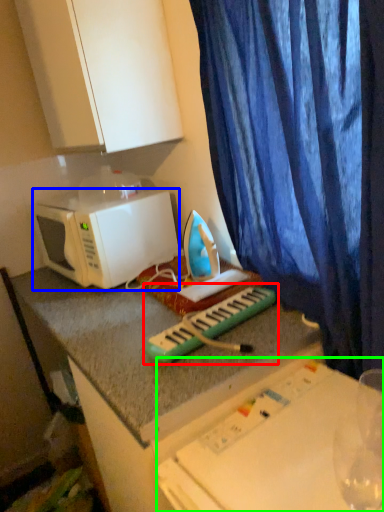
Question: Based on their relative distances, which object is farther from musical keyboard (highlighted by a red box)? Choose from microwave oven (highlighted by a blue box) and table (highlighted by a green box).

Choices:
 (A) microwave oven
 (B) table

Answer: (A)